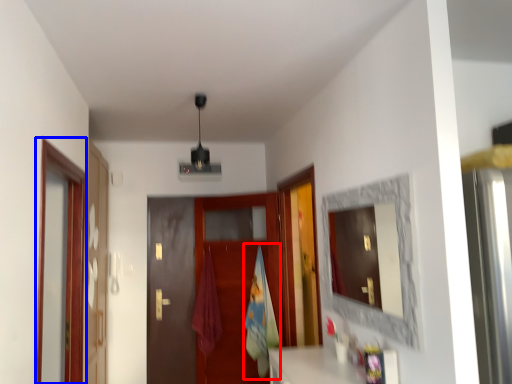
Question: Among these objects, which one is nearest to the camera, beach towel (highlighted by a red box) or screen door (highlighted by a blue box)?

Choices:
 (A) beach towel
 (B) screen door

Answer: (B)